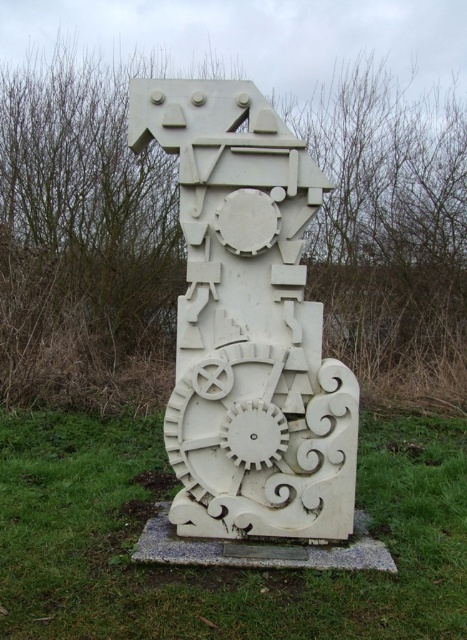
Question: Can you confirm if white carved gear at center is positioned to the right of white marble sculpture at center?

Choices:
 (A) yes
 (B) no

Answer: (B)

Question: Among these objects, which one is nearest to the camera?

Choices:
 (A) white marble sculpture at center
 (B) white carved gear at center

Answer: (B)

Question: Observing the image, what is the correct spatial positioning of white carved gear at center in reference to white marble sculpture at center?

Choices:
 (A) above
 (B) below

Answer: (B)

Question: Is white carved gear at center to the right of white marble sculpture at center from the viewer's perspective?

Choices:
 (A) yes
 (B) no

Answer: (B)

Question: Among these objects, which one is farthest from the camera?

Choices:
 (A) white marble sculpture at center
 (B) white carved gear at center

Answer: (A)